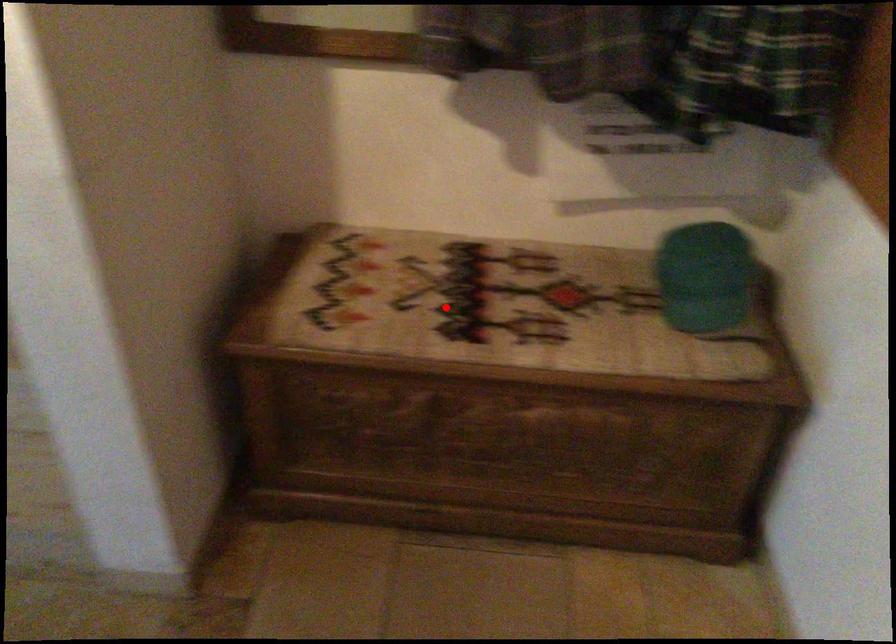
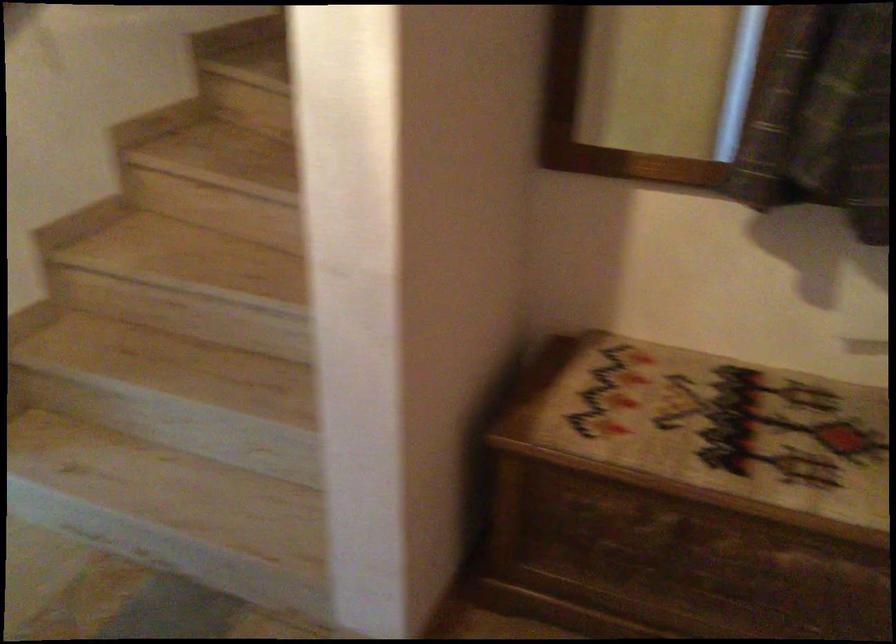
In the second image, find the point that corresponds to the highlighted location in the first image.

(709, 431)